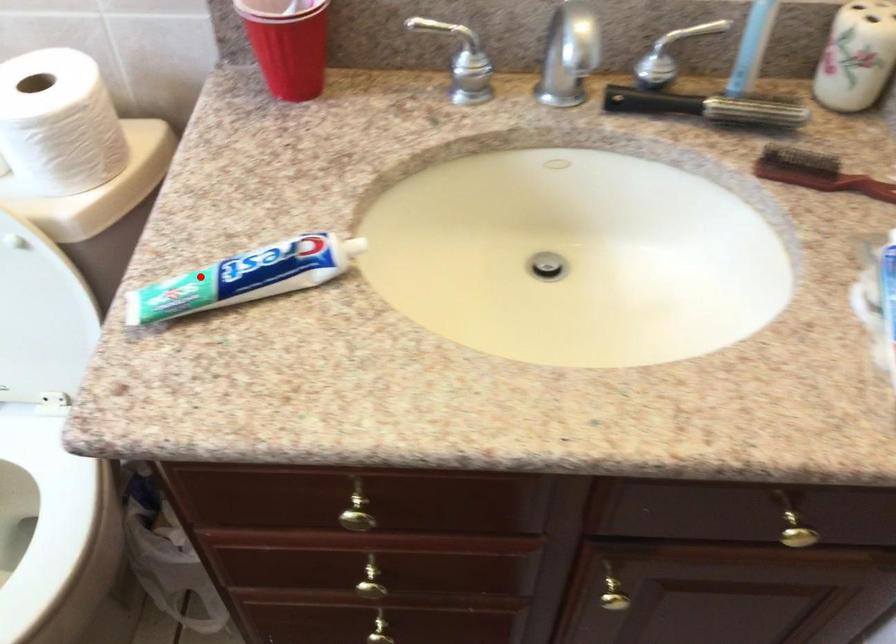
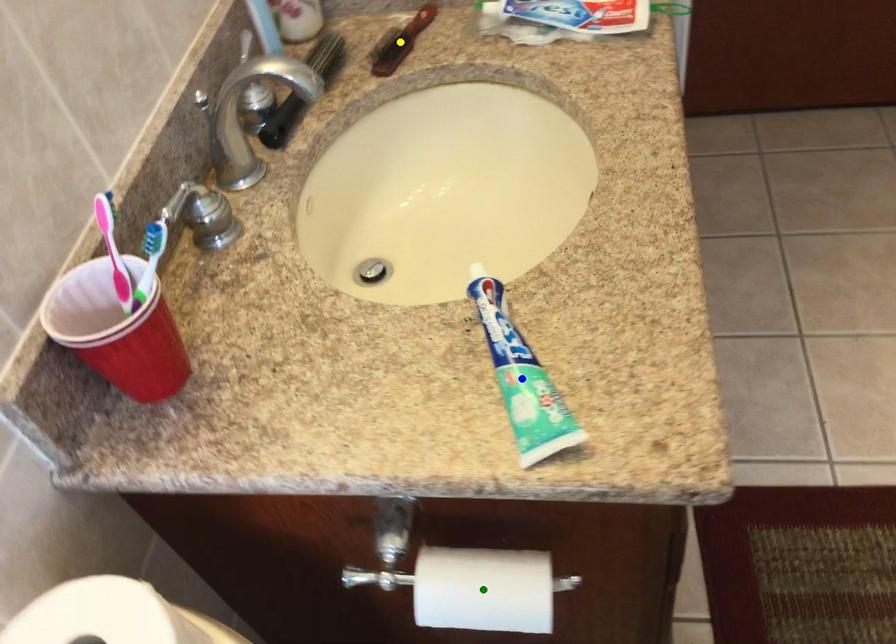
Question: I am providing you with two images of the same scene from different viewpoints. A red point is marked on the first image. You are given multiple points on the second image. Which spot in image 2 lines up with the point in image 1?

Choices:
 (A) blue point
 (B) yellow point
 (C) green point

Answer: (A)